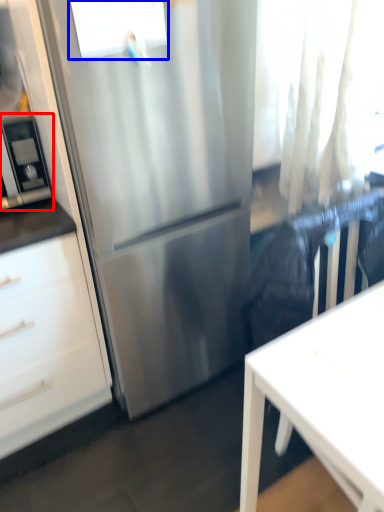
Question: Which object is closer to the camera taking this photo, appliance (highlighted by a red box) or window (highlighted by a blue box)?

Choices:
 (A) appliance
 (B) window

Answer: (B)